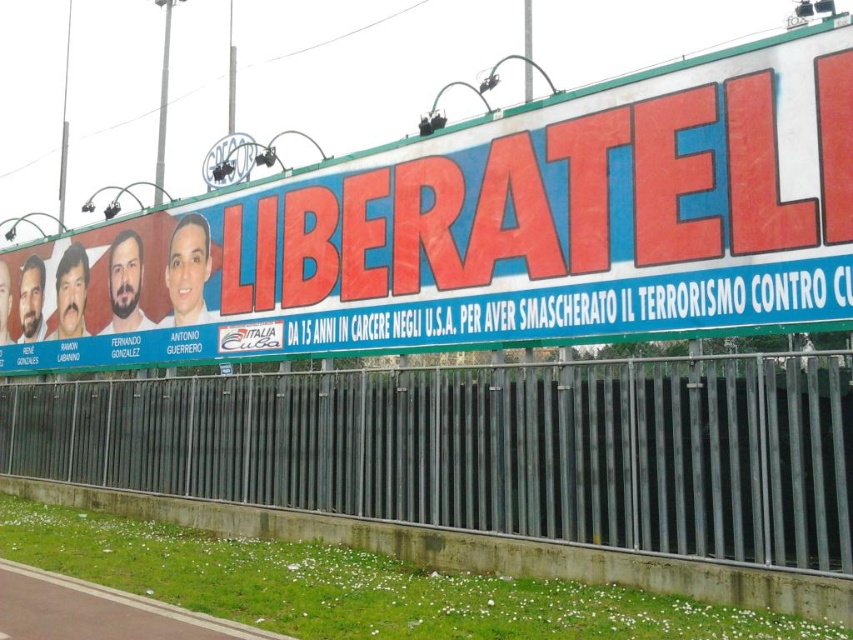
Question: Is red plastic billboard at upper center bigger than metallic gray fence at lower center?

Choices:
 (A) no
 (B) yes

Answer: (B)

Question: Which point is closer to the camera?

Choices:
 (A) red plastic billboard at upper center
 (B) metallic gray fence at lower center

Answer: (B)

Question: Is red plastic billboard at upper center to the left of metallic gray fence at lower center from the viewer's perspective?

Choices:
 (A) yes
 (B) no

Answer: (A)

Question: Which point appears closest to the camera in this image?

Choices:
 (A) (535, 451)
 (B) (140, 253)

Answer: (A)

Question: Is red plastic billboard at upper center to the right of metallic gray fence at lower center from the viewer's perspective?

Choices:
 (A) yes
 (B) no

Answer: (B)

Question: Which point appears closest to the camera in this image?

Choices:
 (A) (117, 451)
 (B) (798, 44)

Answer: (B)